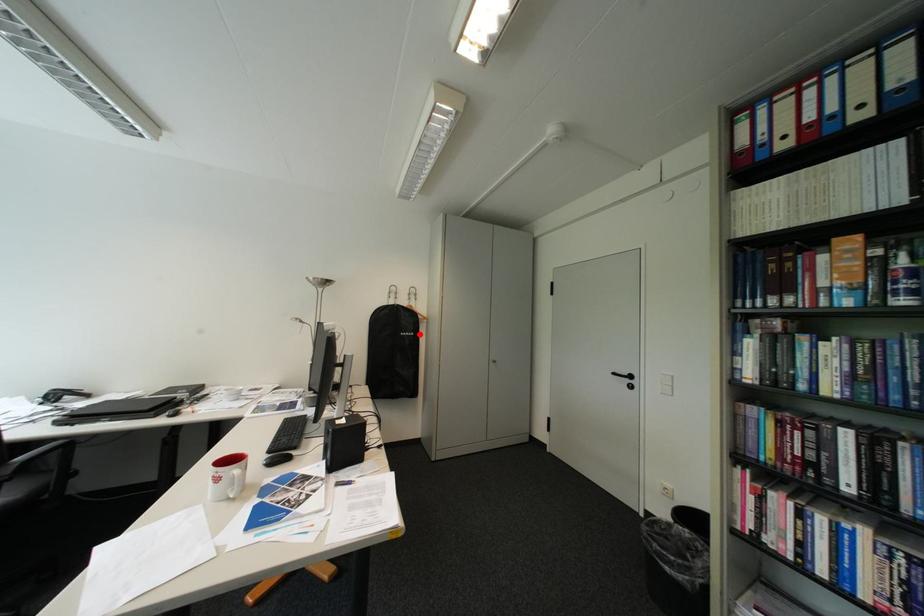
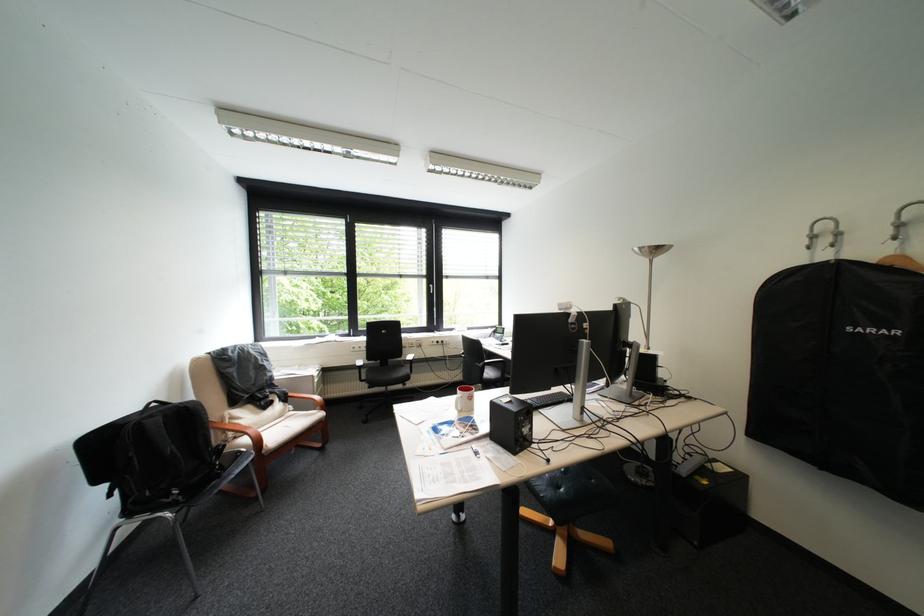
Question: I am providing you with two images of the same scene from different viewpoints. A red point is marked on the first image. Can you still see the location of the red point in image 2?

Choices:
 (A) Yes
 (B) No

Answer: (A)